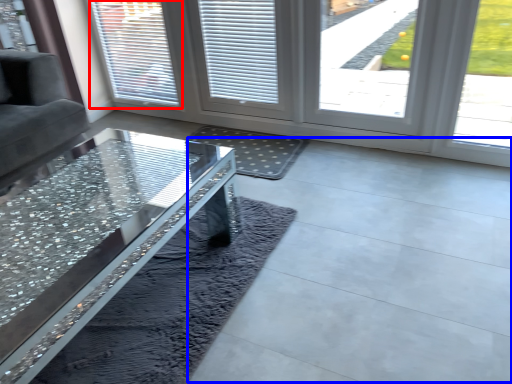
Question: Which point is further to the camera, window (highlighted by a red box) or concrete (highlighted by a blue box)?

Choices:
 (A) window
 (B) concrete

Answer: (A)